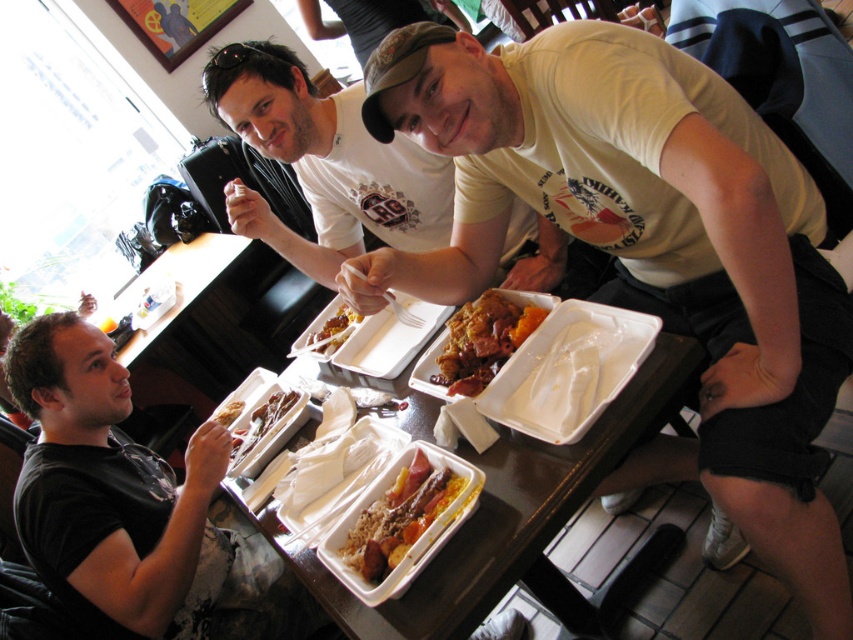
Question: Which point is farther to the camera?

Choices:
 (A) golden brown meat at center
 (B) shiny plastic fork at center
 (C) white glossy rice at center

Answer: (C)

Question: Can you confirm if matte white t-shirt at center is positioned to the left of white styrofoam trays at center?

Choices:
 (A) yes
 (B) no

Answer: (A)

Question: Which point is farther to the camera?

Choices:
 (A) (380, 545)
 (B) (448, 122)
 (C) (543, 412)
 (D) (323, 328)

Answer: (D)

Question: Does matte white t-shirt at center have a greater width compared to golden brown rice at center?

Choices:
 (A) yes
 (B) no

Answer: (A)

Question: Can you confirm if golden brown rice at center is positioned below yellow matte rice at center?

Choices:
 (A) no
 (B) yes

Answer: (B)

Question: Which object is the farthest from the white matte t-shirt at upper center?

Choices:
 (A) golden brown rice at center
 (B) shiny plastic fork at center

Answer: (B)